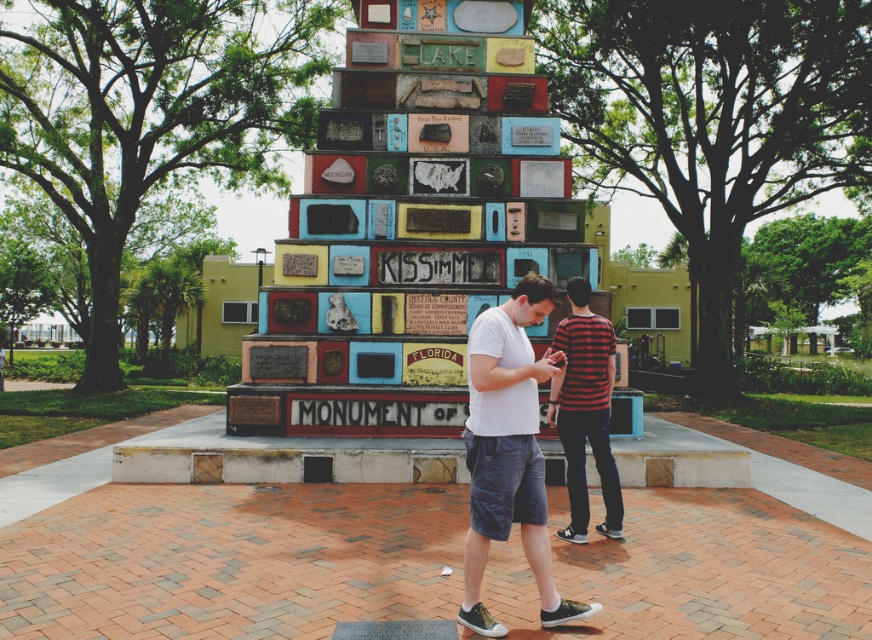
Question: Among these objects, which one is nearest to the camera?

Choices:
 (A) striped cotton shirt at center
 (B) white cotton t-shirt at center

Answer: (B)

Question: Does white cotton t-shirt at center appear on the left side of striped cotton shirt at center?

Choices:
 (A) yes
 (B) no

Answer: (A)

Question: Among these objects, which one is farthest from the camera?

Choices:
 (A) striped cotton shirt at center
 (B) white cotton t-shirt at center

Answer: (A)

Question: Can you confirm if white cotton t-shirt at center is positioned below striped cotton shirt at center?

Choices:
 (A) yes
 (B) no

Answer: (A)

Question: Does white cotton t-shirt at center appear under striped cotton shirt at center?

Choices:
 (A) no
 (B) yes

Answer: (B)